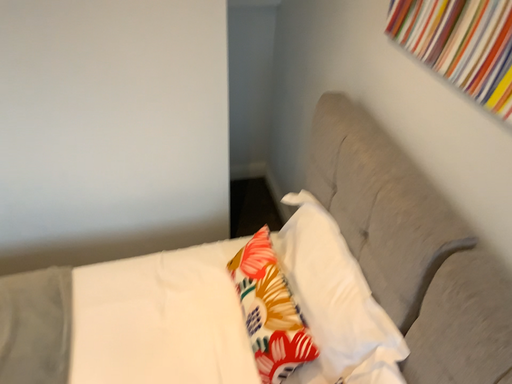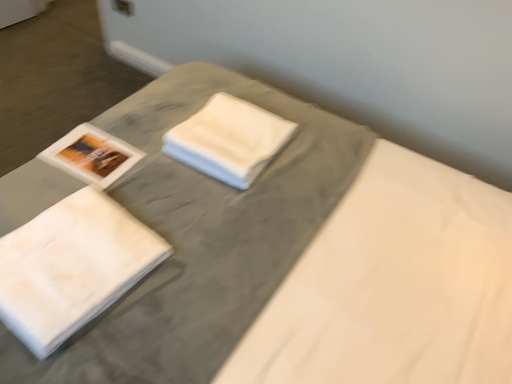
Question: Which way did the camera rotate in the video?

Choices:
 (A) rotated downward
 (B) rotated upward

Answer: (B)